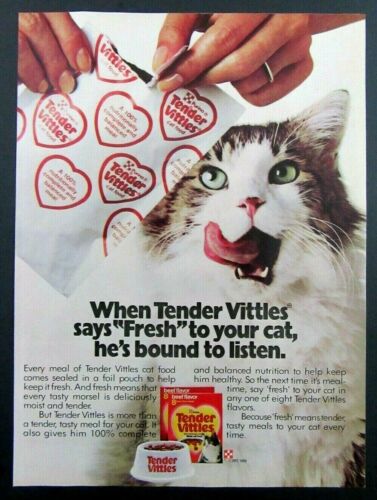
Locate an element on the screen. bowl is located at coordinates (180, 470).